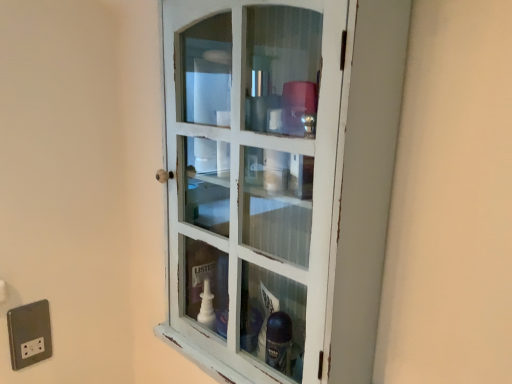
Question: Does silver metallic outlet at lower left have a lesser width compared to white distressed wood cabinet at center?

Choices:
 (A) yes
 (B) no

Answer: (A)

Question: Can you confirm if silver metallic outlet at lower left is positioned to the right of white distressed wood cabinet at center?

Choices:
 (A) yes
 (B) no

Answer: (B)

Question: Considering the relative sizes of silver metallic outlet at lower left and white distressed wood cabinet at center in the image provided, is silver metallic outlet at lower left shorter than white distressed wood cabinet at center?

Choices:
 (A) yes
 (B) no

Answer: (A)

Question: From the image's perspective, would you say silver metallic outlet at lower left is shown under white distressed wood cabinet at center?

Choices:
 (A) no
 (B) yes

Answer: (B)

Question: From a real-world perspective, does silver metallic outlet at lower left sit lower than white distressed wood cabinet at center?

Choices:
 (A) yes
 (B) no

Answer: (A)

Question: Is silver metallic outlet at lower left completely or partially outside of white distressed wood cabinet at center?

Choices:
 (A) yes
 (B) no

Answer: (A)

Question: Would you say white distressed wood cabinet at center is a long distance from silver metallic outlet at lower left?

Choices:
 (A) yes
 (B) no

Answer: (B)

Question: From a real-world perspective, is white distressed wood cabinet at center under silver metallic outlet at lower left?

Choices:
 (A) yes
 (B) no

Answer: (B)

Question: Is white distressed wood cabinet at center at the right side of silver metallic outlet at lower left?

Choices:
 (A) yes
 (B) no

Answer: (A)

Question: From a real-world perspective, is white distressed wood cabinet at center physically above silver metallic outlet at lower left?

Choices:
 (A) yes
 (B) no

Answer: (A)

Question: Is white distressed wood cabinet at center completely or partially outside of silver metallic outlet at lower left?

Choices:
 (A) no
 (B) yes

Answer: (B)

Question: Can you confirm if white distressed wood cabinet at center is bigger than silver metallic outlet at lower left?

Choices:
 (A) yes
 (B) no

Answer: (A)

Question: Considering the positions of white distressed wood cabinet at center and silver metallic outlet at lower left in the image, is white distressed wood cabinet at center bigger or smaller than silver metallic outlet at lower left?

Choices:
 (A) big
 (B) small

Answer: (A)